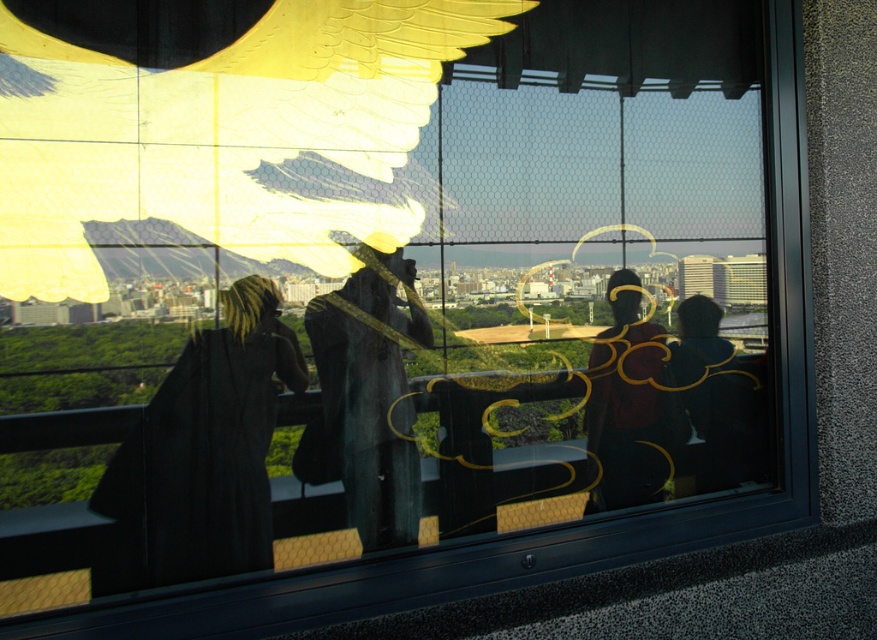
Question: Can you confirm if golden textured wings at upper center is thinner than black matte coat at left?

Choices:
 (A) no
 (B) yes

Answer: (A)

Question: Which object is farther from the camera taking this photo?

Choices:
 (A) dark matte statue at center
 (B) golden textured wings at upper center
 (C) matte black robe at center
 (D) black matte coat at left

Answer: (A)

Question: Which of the following is the farthest from the observer?

Choices:
 (A) (257, 209)
 (B) (391, 520)
 (C) (134, 440)
 (D) (706, 458)

Answer: (A)

Question: Which of the following is the closest to the observer?

Choices:
 (A) dark matte statue at center
 (B) black matte jacket at right

Answer: (B)

Question: Is matte black robe at center wider than black matte jacket at right?

Choices:
 (A) yes
 (B) no

Answer: (B)

Question: Is black matte coat at left further to the viewer compared to black matte jacket at right?

Choices:
 (A) yes
 (B) no

Answer: (B)